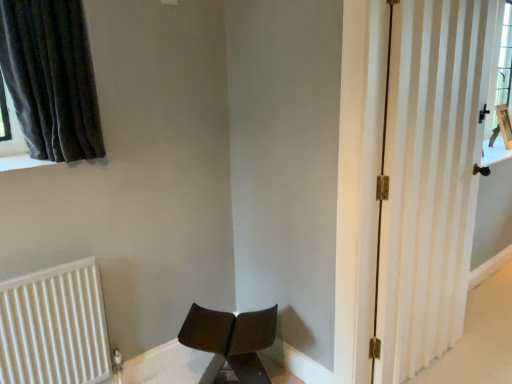
Question: From a real-world perspective, is white striped door at right positioned above or below dark grey fabric curtain at upper left?

Choices:
 (A) above
 (B) below

Answer: (B)

Question: From the image's perspective, is white striped door at right above or below dark grey fabric curtain at upper left?

Choices:
 (A) below
 (B) above

Answer: (A)

Question: Which is farther from the matte brown chair at lower center?

Choices:
 (A) dark grey fabric curtain at upper left
 (B) white striped door at right
 (C) white ribbed radiator at lower left

Answer: (A)

Question: Which is farther from the dark grey fabric curtain at upper left?

Choices:
 (A) white striped door at right
 (B) matte brown chair at lower center
 (C) white ribbed radiator at lower left

Answer: (A)